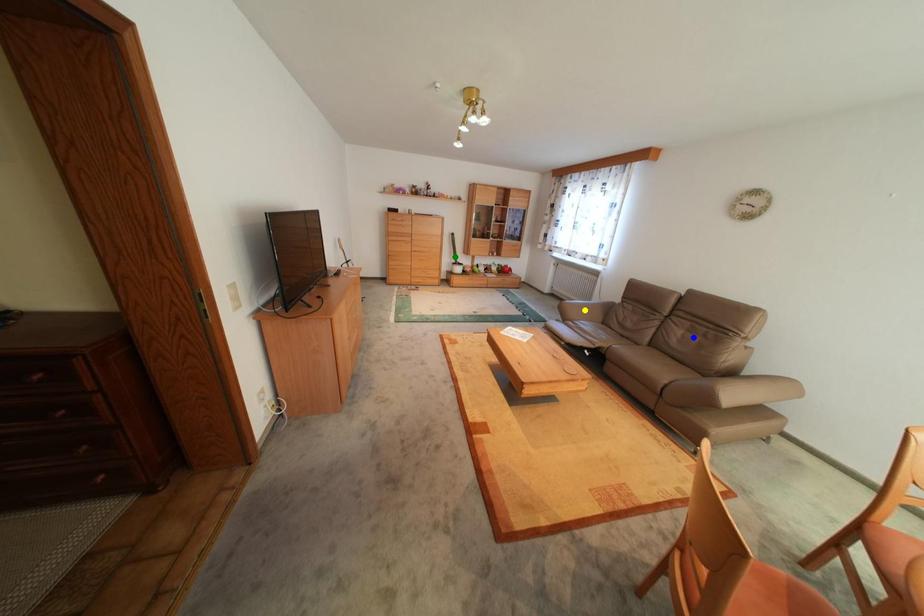
Order these from farthest to nearest:
green point
blue point
yellow point

green point, yellow point, blue point